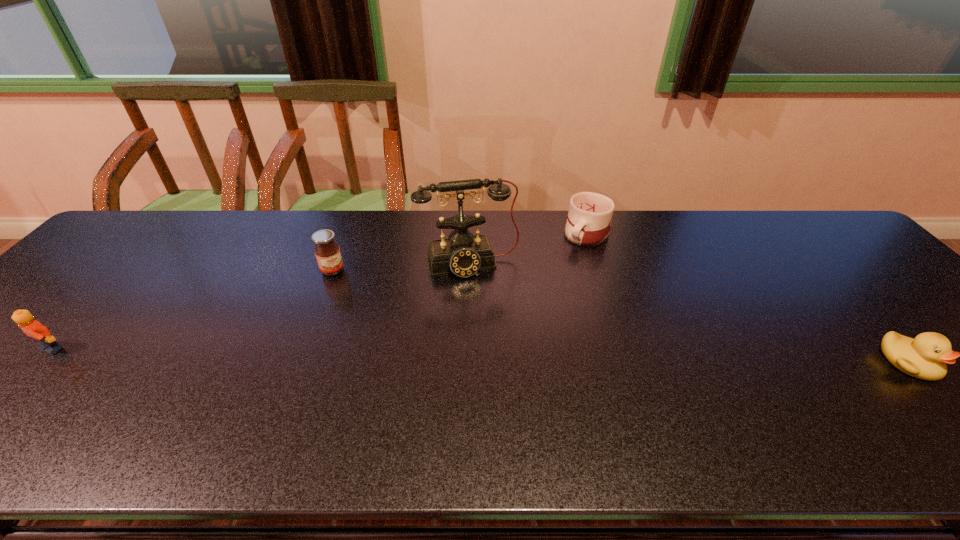
At what (x,y) coordinates should I click in order to perform the action: click on object that is at the left edge. Please return your answer as a coordinate pair (x, y). The height and width of the screenshot is (540, 960). Looking at the image, I should click on [32, 328].

The image size is (960, 540). I want to click on object situated at the right edge, so click(x=925, y=357).

Find the location of `object located at the near right corner`. object located at the near right corner is located at coordinates (925, 357).

The image size is (960, 540). Identify the location of vacant area at the far edge. (543, 251).

I want to click on free space at the near edge, so click(x=422, y=404).

Locate an element on the screen. This screenshot has height=540, width=960. vacant space at the left edge is located at coordinates (125, 280).

This screenshot has width=960, height=540. Find the location of `blank area at the right edge`. blank area at the right edge is located at coordinates (894, 283).

Identify the location of free space between the leftmost object and the mug. The image size is (960, 540). (320, 292).

This screenshot has width=960, height=540. Identify the location of vacant point located between the Lego and the third object from left to right. (260, 306).

At what (x,y) coordinates should I click in order to perform the action: click on free spot between the leftmost object and the rightmost object. Please return your answer as a coordinate pair (x, y). This screenshot has width=960, height=540. Looking at the image, I should click on 480,355.